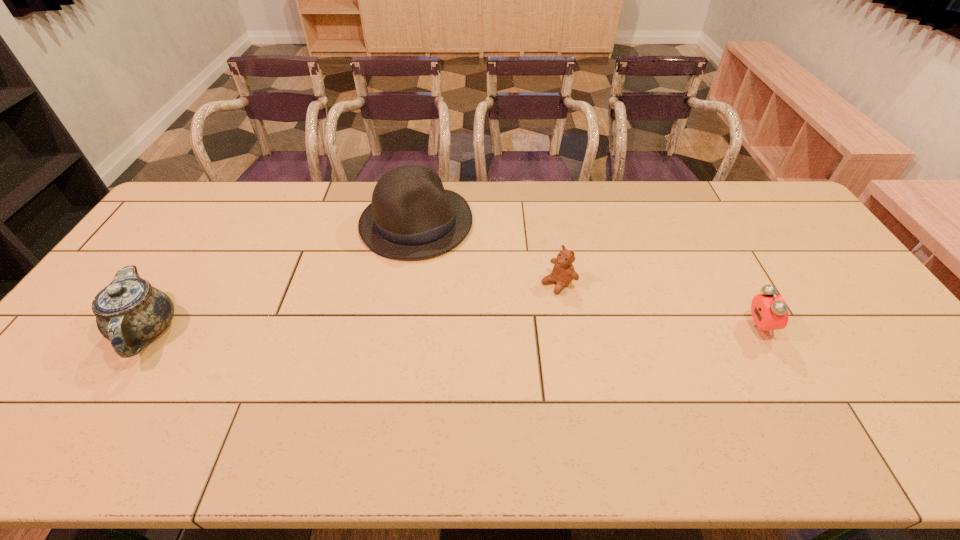
Select which object appears as the closest to the teddy bear. Please provide its 2D coordinates. Your answer should be formatted as a tuple, i.e. [(x, y)], where the tuple contains the x and y coordinates of a point satisfying the conditions above.

[(412, 216)]

This screenshot has width=960, height=540. Find the location of `free location that satisfies the following two spatial constraints: 1. on the front side of the third object from right to left; 2. on the front-facing side of the alarm clock`. free location that satisfies the following two spatial constraints: 1. on the front side of the third object from right to left; 2. on the front-facing side of the alarm clock is located at coordinates (400, 327).

At what (x,y) coordinates should I click in order to perform the action: click on vacant region that satisfies the following two spatial constraints: 1. on the front side of the bowler hat; 2. on the front-facing side of the rightmost object. Please return your answer as a coordinate pair (x, y). Looking at the image, I should click on (400, 327).